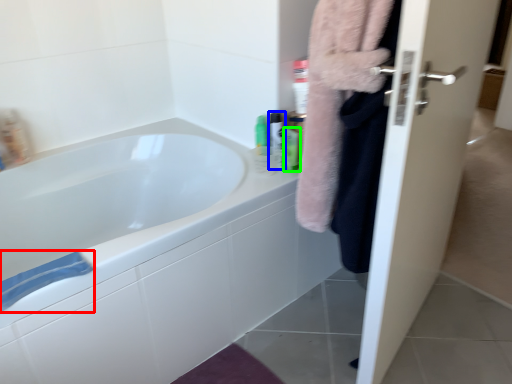
Question: Which is farther away from bath towel (highlighted by a red box)? mouthwash (highlighted by a blue box) or mouthwash (highlighted by a green box)?

Choices:
 (A) mouthwash
 (B) mouthwash

Answer: (B)